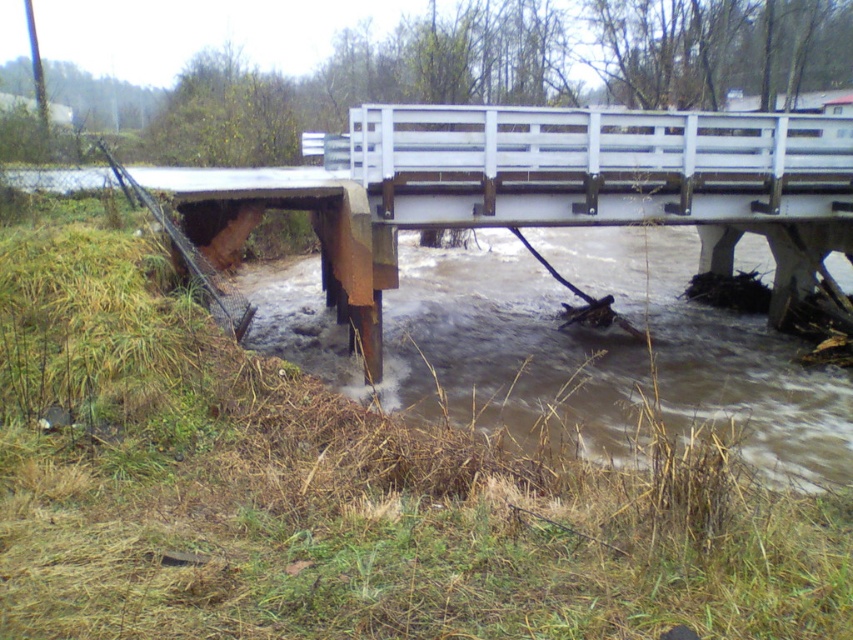
How far apart are rusty metal bridge at left and brown muddy water at lower center?

8.75 feet

Is point (720, 113) positioned after point (410, 307)?

No.

Between point (834, 160) and point (534, 358), which one is positioned behind?

The point (534, 358) is more distant.

Find the location of a particular element. Image resolution: width=853 pixels, height=640 pixels. rusty metal bridge at left is located at coordinates 534,189.